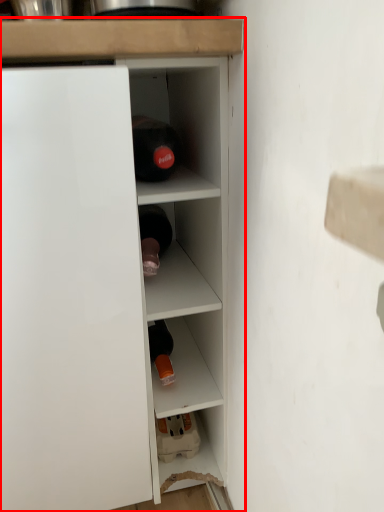
Question: In this image, where is cupboard (annotated by the red box) located relative to cabinet?

Choices:
 (A) left
 (B) right

Answer: (A)